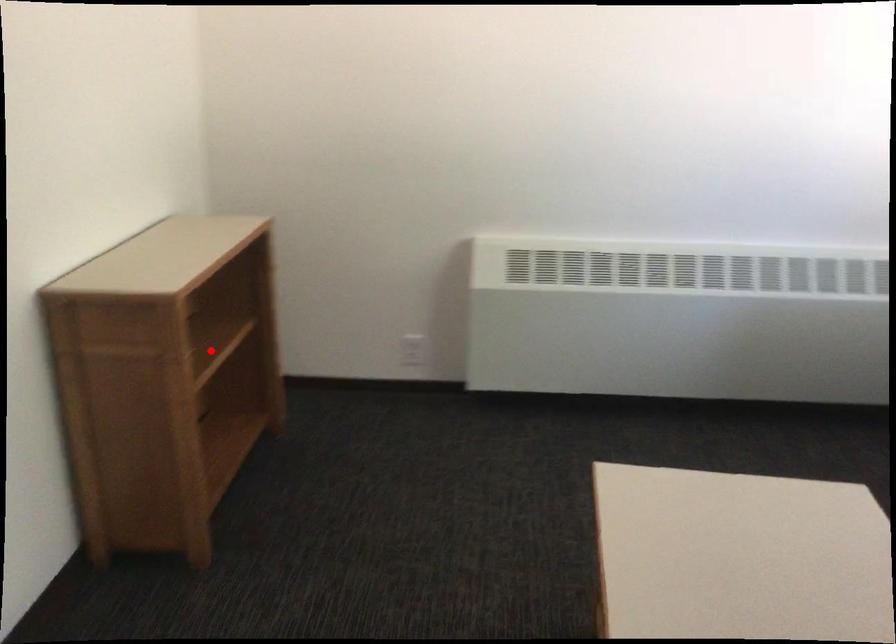
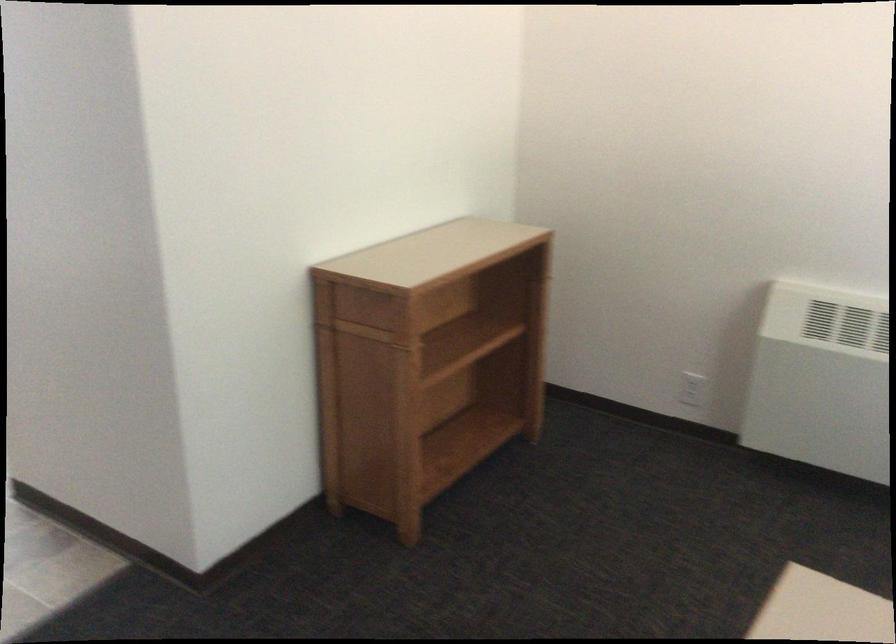
Locate, in the second image, the point that corresponds to the highlighted location in the first image.

(462, 345)